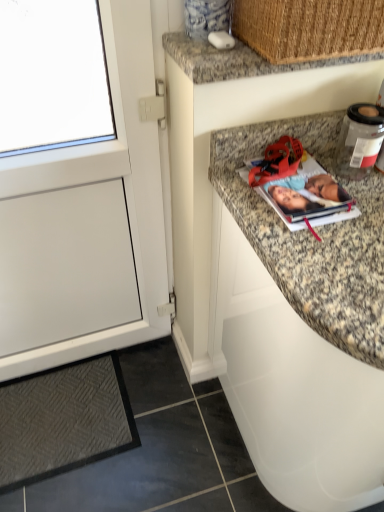
Question: Visually, is matte paper photo album at upper right positioned to the left or to the right of dark gray textured mat at lower left?

Choices:
 (A) left
 (B) right

Answer: (B)

Question: From the image's perspective, relative to dark gray textured mat at lower left, is matte paper photo album at upper right above or below?

Choices:
 (A) below
 (B) above

Answer: (B)

Question: Which of these objects is positioned farthest from the white matte cabinet at left, the 1th cabinetry when ordered from left to right?

Choices:
 (A) dark gray textured mat at lower left
 (B) woven straw basket at upper right
 (C) clear plastic bottle at upper right
 (D) matte paper photo album at upper right
 (E) granite countertop at upper right, the 2th cabinetry when ordered from left to right

Answer: (C)

Question: Which is nearer to the white matte cabinet at left, which is counted as the 2th cabinetry, starting from the right?

Choices:
 (A) granite countertop at upper right, the 2th cabinetry when ordered from left to right
 (B) woven straw basket at upper right
 (C) granite countertop at upper center
 (D) dark gray textured mat at lower left
 (E) clear plastic bottle at upper right

Answer: (D)